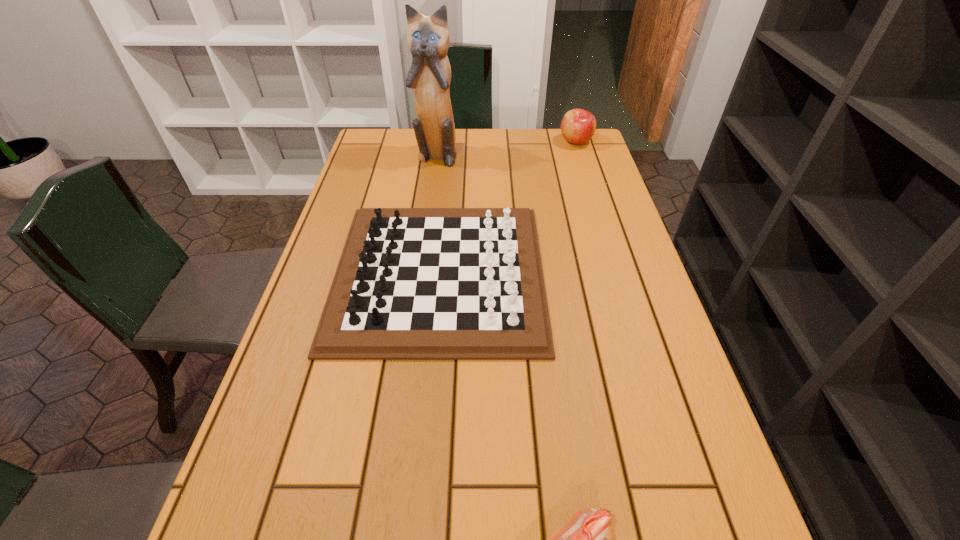
Locate an element on the screen. object at the left edge is located at coordinates (412, 283).

Identify the location of object at the right edge. This screenshot has height=540, width=960. (578, 126).

I want to click on object that is at the far right corner, so click(x=578, y=126).

In the image, there is a desktop. Where is `vacant space at the left edge`? This screenshot has height=540, width=960. vacant space at the left edge is located at coordinates (311, 417).

Locate an element on the screen. Image resolution: width=960 pixels, height=540 pixels. free space at the right edge of the desktop is located at coordinates (679, 468).

Find the location of a particular element. This screenshot has height=540, width=960. vacant region between the third shortest object and the tallest object is located at coordinates (506, 148).

Select which object is the third closest to the shortest object. Please provide its 2D coordinates. Your answer should be formatted as a tuple, i.e. [(x, y)], where the tuple contains the x and y coordinates of a point satisfying the conditions above.

[(578, 126)]

At what (x,y) coordinates should I click in order to perform the action: click on object that stands as the second closest to the apple. Please return your answer as a coordinate pair (x, y). Looking at the image, I should click on (412, 283).